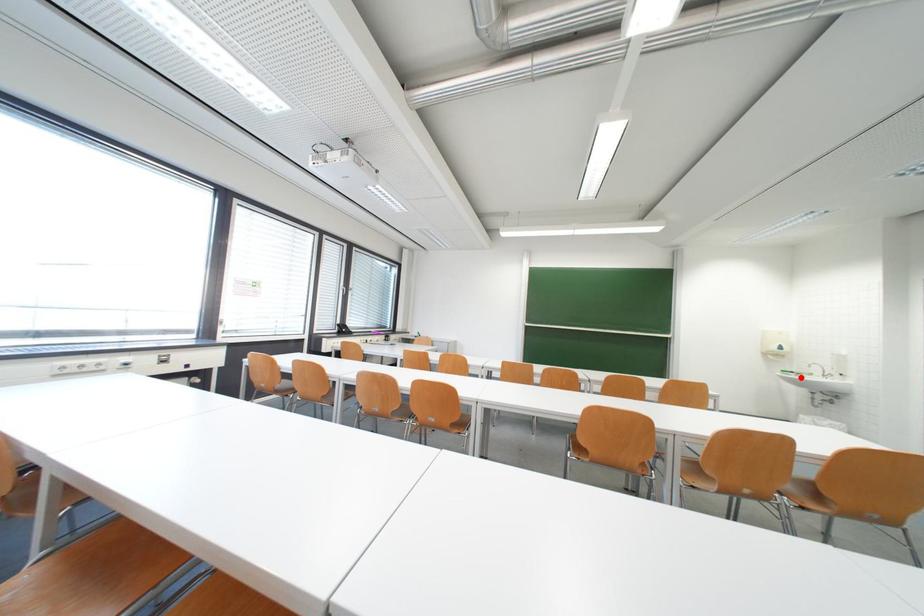
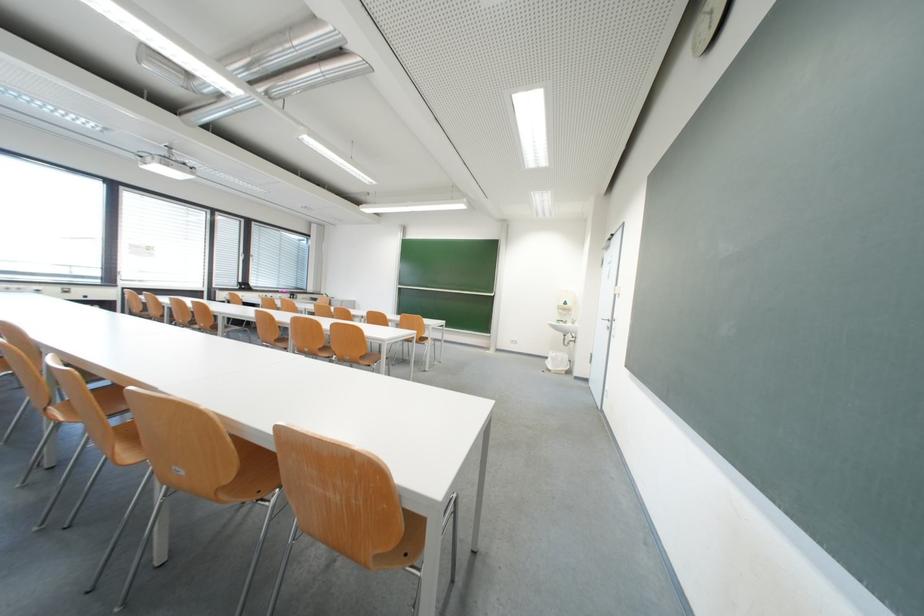
Find the pixel in the second image that matches the highlighted location in the first image.

(570, 326)